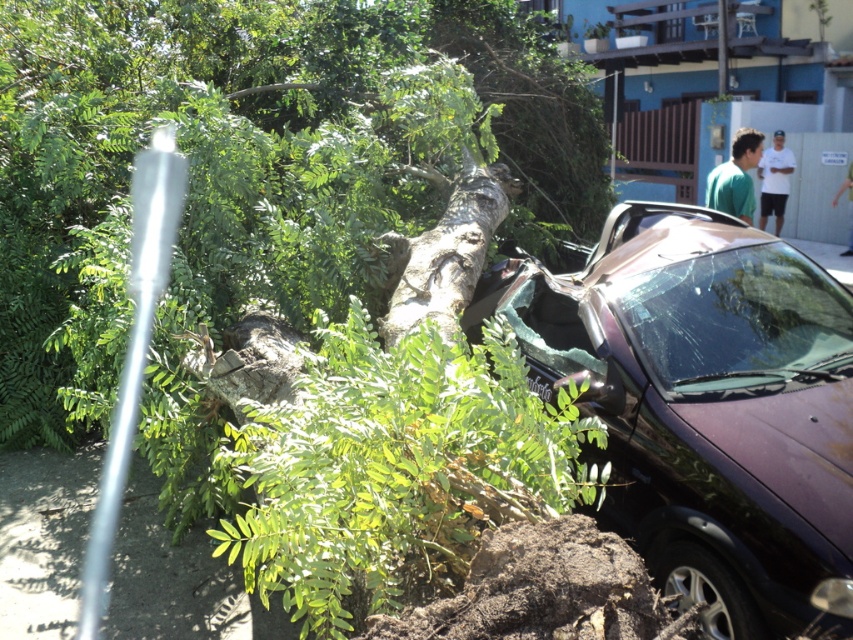
Question: Does metallic purple car at center have a smaller size compared to green matte shirt at upper right?

Choices:
 (A) no
 (B) yes

Answer: (A)

Question: Which point appears farthest from the camera in this image?

Choices:
 (A) (730, 144)
 (B) (764, 483)
 (C) (115, 355)

Answer: (A)

Question: Is metallic purple car at center below green matte shirt at upper right?

Choices:
 (A) yes
 (B) no

Answer: (A)

Question: Which of these objects is positioned closest to the green leafy tree trunk at center?

Choices:
 (A) green matte shirt at upper right
 (B) metallic purple car at center

Answer: (A)

Question: Considering the relative positions of metallic purple car at center and green matte shirt at upper right in the image provided, where is metallic purple car at center located with respect to green matte shirt at upper right?

Choices:
 (A) left
 (B) right

Answer: (A)

Question: Among these points, which one is nearest to the camera?

Choices:
 (A) (764, 211)
 (B) (851, 406)
 (C) (746, 168)
 (D) (502, 0)

Answer: (B)